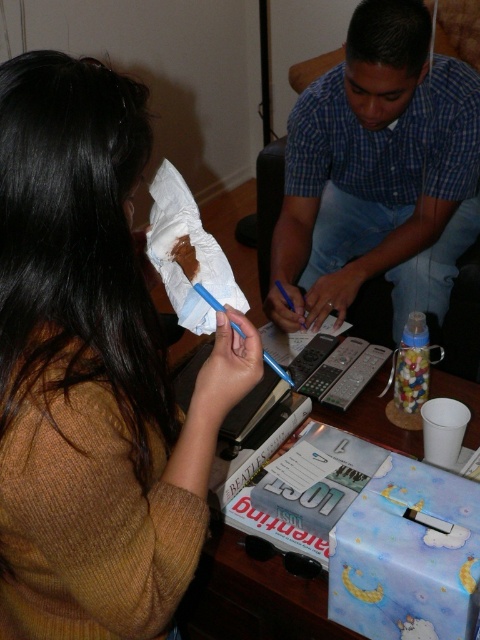
You are a photographer positioned to the side of the table. You want to capture a photo of the blue plaid shirt at center and the white soft toilet paper at center without any obstructions. Based on their positions, which object should you move closer to the left to ensure both are visible in the frame?

The blue plaid shirt at center is to the right of white soft toilet paper at center. To ensure both are visible without obstruction, you should move the blue plaid shirt at center closer to the left so it aligns with the white soft toilet paper at center.

You are standing at the point closest to the camera. Which point, point (x=416, y=164) or point (x=184, y=273), is farther away from you?

Point (x=416, y=164) is behind point (x=184, y=273), so it is farther away from you.

You are standing at the entrance of the room and see the scene described. There is a blue plaid shirt at center located at point (377,173). If you walk straight towards the blue plaid shirt at center, will you first encounter the person on the left or the person on the right?

The blue plaid shirt at center is located at point (377,173). Since the person on the right is wearing the blue plaid shirt at center, you will first encounter the person on the right when walking straight towards that point.